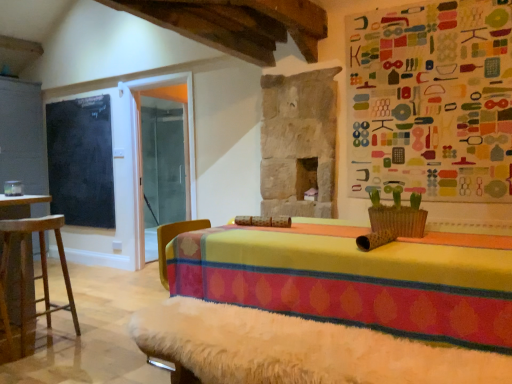
You are a GUI agent. You are given a task and a screenshot of the screen. Output one action in this format:
    pyautogui.click(x=<x>, y=<y>)
    Task: Click on the white fur-covered bench at lower center
    This screenshot has width=512, height=384.
    Given the screenshot: What is the action you would take?
    coord(298,349)

Describe the element at coordinates (81, 161) in the screenshot. I see `black chalkboard at left` at that location.

Locate an element on the screen. wooden stool at left is located at coordinates (34, 277).

Who is taller, white fur-covered bench at lower center or wooden stool at left?

Standing taller between the two is wooden stool at left.

Is white fur-covered bench at lower center situated inside wooden stool at left or outside?

white fur-covered bench at lower center is not enclosed by wooden stool at left.

Is white fur-covered bench at lower center turned away from wooden stool at left?

white fur-covered bench at lower center does not have its back to wooden stool at left.

This screenshot has width=512, height=384. I want to click on furniture behind the white fur-covered bench at lower center, so click(34, 277).

Considering their positions, is wooden stool at left located in front of or behind black chalkboard at left?

wooden stool at left is in front of black chalkboard at left.

Which point is more distant from viewer, (42,265) or (106,225)?

The point (106,225) is farther.

Can you confirm if wooden stool at left is shorter than black chalkboard at left?

Yes.

From the image's perspective, would you say wooden stool at left is positioned over black chalkboard at left?

Incorrect, from the image's perspective, wooden stool at left is lower than black chalkboard at left.

From a real-world perspective, between white fur-covered bench at lower center and black chalkboard at left, who is vertically lower?

white fur-covered bench at lower center, from a real-world perspective.

Does white fur-covered bench at lower center have a greater height compared to black chalkboard at left?

In fact, white fur-covered bench at lower center may be shorter than black chalkboard at left.

In the image, is white fur-covered bench at lower center positioned in front of or behind black chalkboard at left?

white fur-covered bench at lower center is positioned closer to the viewer than black chalkboard at left.

Is white fur-covered bench at lower center directly adjacent to black chalkboard at left?

There is a gap between white fur-covered bench at lower center and black chalkboard at left.

Which of these two, black chalkboard at left or wooden stool at left, is smaller?

With smaller size is black chalkboard at left.

Can you tell me how much black chalkboard at left and wooden stool at left differ in facing direction?

The angle between the facing direction of black chalkboard at left and the facing direction of wooden stool at left is 89.4 degrees.

Is point (95, 220) closer to camera compared to point (41, 267)?

No, it is behind (41, 267).

Is black chalkboard at left wider than wooden stool at left?

In fact, black chalkboard at left might be narrower than wooden stool at left.

From the image's perspective, between wooden stool at left and white fur-covered bench at lower center, who is located below?

white fur-covered bench at lower center, from the image's perspective.

From a real-world perspective, is wooden stool at left physically located above or below white fur-covered bench at lower center?

wooden stool at left is above white fur-covered bench at lower center.

Is wooden stool at left positioned with its back to white fur-covered bench at lower center?

No, wooden stool at left is not facing the opposite direction of white fur-covered bench at lower center.

Is wooden stool at left further to the viewer compared to white fur-covered bench at lower center?

Yes, it is.

Does black chalkboard at left turn towards white fur-covered bench at lower center?

No.

Are black chalkboard at left and white fur-covered bench at lower center located far from each other?

Yes, black chalkboard at left is far from white fur-covered bench at lower center.

From the image's perspective, which is below, black chalkboard at left or white fur-covered bench at lower center?

white fur-covered bench at lower center appears lower in the image.

Is black chalkboard at left located outside white fur-covered bench at lower center?

black chalkboard at left is positioned outside white fur-covered bench at lower center.

In order to click on furniture above the white fur-covered bench at lower center (from the image's perspective) in this screenshot , I will do coord(34,277).

At what (x,y) coordinates should I click in order to perform the action: click on furniture to the right of black chalkboard at left. Please return your answer as a coordinate pair (x, y). The height and width of the screenshot is (384, 512). Looking at the image, I should click on (34, 277).

Based on their spatial positions, is black chalkboard at left or white fur-covered bench at lower center closer to wooden stool at left?

white fur-covered bench at lower center.

When comparing their distances from white fur-covered bench at lower center, does black chalkboard at left or wooden stool at left seem closer?

The object closer to white fur-covered bench at lower center is wooden stool at left.

Estimate the real-world distances between objects in this image. Which object is closer to white fur-covered bench at lower center, wooden stool at left or black chalkboard at left?

Among the two, wooden stool at left is located nearer to white fur-covered bench at lower center.

Based on their spatial positions, is white fur-covered bench at lower center or black chalkboard at left further from wooden stool at left?

black chalkboard at left.

Based on their spatial positions, is white fur-covered bench at lower center or wooden stool at left closer to black chalkboard at left?

wooden stool at left lies closer to black chalkboard at left than the other object.

Considering their positions, is wooden stool at left positioned further to black chalkboard at left than white fur-covered bench at lower center?

white fur-covered bench at lower center lies further to black chalkboard at left than the other object.

Locate an element on the screen. The image size is (512, 384). furniture between white fur-covered bench at lower center and black chalkboard at left along the z-axis is located at coordinates (34, 277).